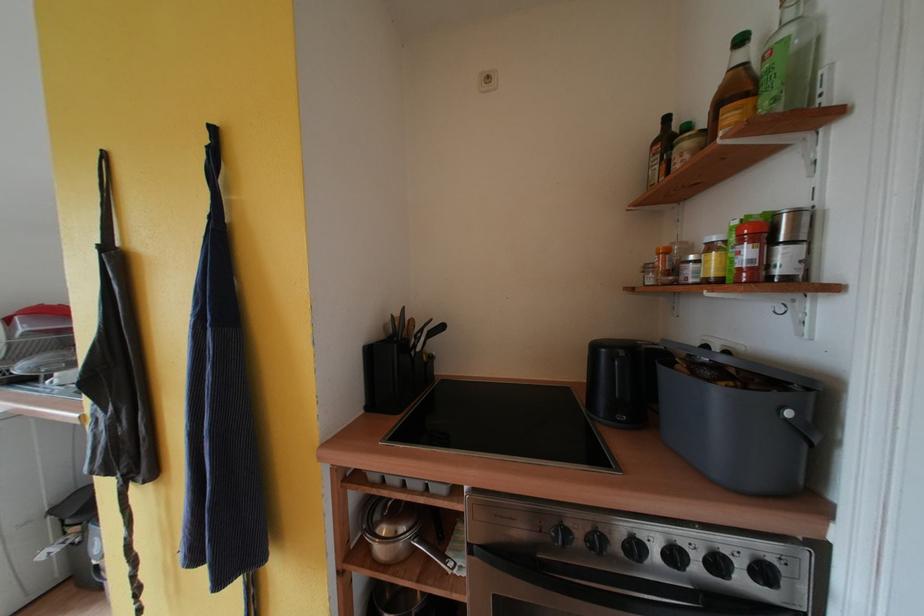
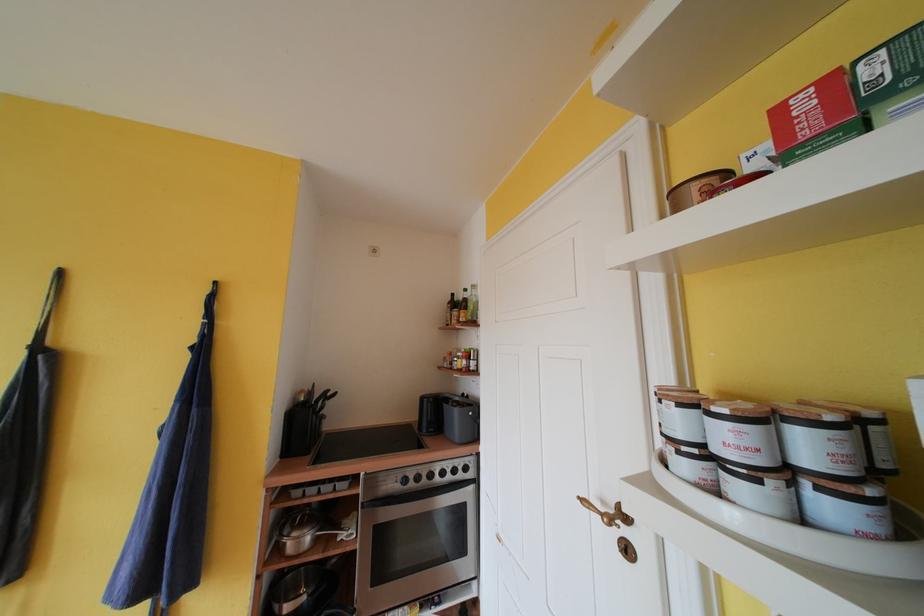
Locate, in the second image, the point that corresponds to the point at 392,331 in the first image.

(301, 402)